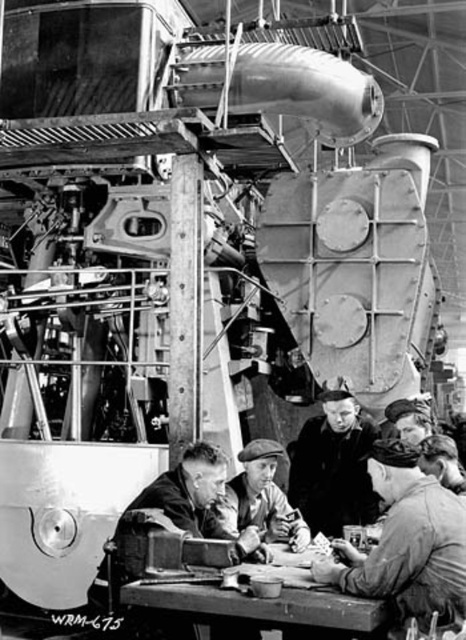
Question: Can you confirm if dark gray uniform at center is bigger than smooth wooden table at center?

Choices:
 (A) yes
 (B) no

Answer: (A)

Question: Which point appears farthest from the camera in this image?

Choices:
 (A) (363, 595)
 (B) (205, 449)

Answer: (B)

Question: Is dark fabric cap at center positioned at the back of smooth wooden table at center?

Choices:
 (A) yes
 (B) no

Answer: (A)

Question: Which is nearer to the light brown leather cap at center?

Choices:
 (A) dark fabric cap at center
 (B) smooth wooden table at center
 (C) dark gray leather jacket at center
 (D) dark gray uniform at center

Answer: (C)

Question: Among these objects, which one is nearest to the camera?

Choices:
 (A) dark fabric cap at center
 (B) dark gray uniform at center

Answer: (B)

Question: Is dark gray uniform at center further to the viewer compared to smooth wooden table at center?

Choices:
 (A) yes
 (B) no

Answer: (A)